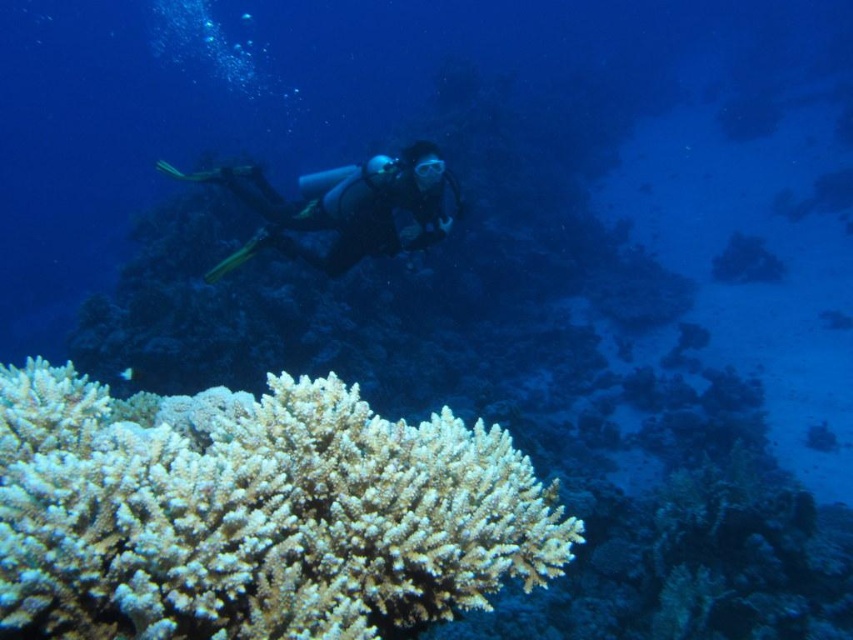
How much distance is there between white coral at lower left and black matte scuba diver at center?

A distance of 3.26 meters exists between white coral at lower left and black matte scuba diver at center.

Based on the photo, is white coral at lower left smaller than black matte scuba diver at center?

Correct, white coral at lower left occupies less space than black matte scuba diver at center.

Between point (277, 547) and point (393, 157), which one is positioned behind?

Point (393, 157)

Identify the location of white coral at lower left. (254, 513).